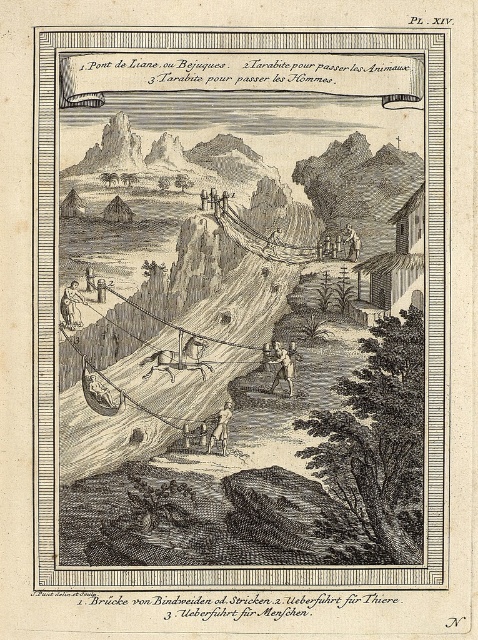
Question: Which object appears closest to the camera in this image?

Choices:
 (A) wooden cart at center
 (B) brown leather figure at lower center

Answer: (B)

Question: Where is wire rope bridge at center located in relation to brown leather horse at center in the image?

Choices:
 (A) above
 (B) below

Answer: (A)

Question: Considering the real-world distances, which object is closest to the brown leather figure at lower center?

Choices:
 (A) brown leather horse at center
 (B) wooden cart at center
 (C) light brown wood figure at lower left
 (D) wire rope bridge at center

Answer: (A)

Question: Considering the relative positions of brown leather figure at lower center and wooden cart at center in the image provided, where is brown leather figure at lower center located with respect to wooden cart at center?

Choices:
 (A) above
 (B) below

Answer: (B)

Question: Is brown leather figure at lower center to the left of wooden cart at center from the viewer's perspective?

Choices:
 (A) no
 (B) yes

Answer: (B)

Question: Which point appears farthest from the camera in this image?

Choices:
 (A) (112, 305)
 (B) (282, 353)
 (C) (355, 256)
 (D) (207, 445)

Answer: (C)